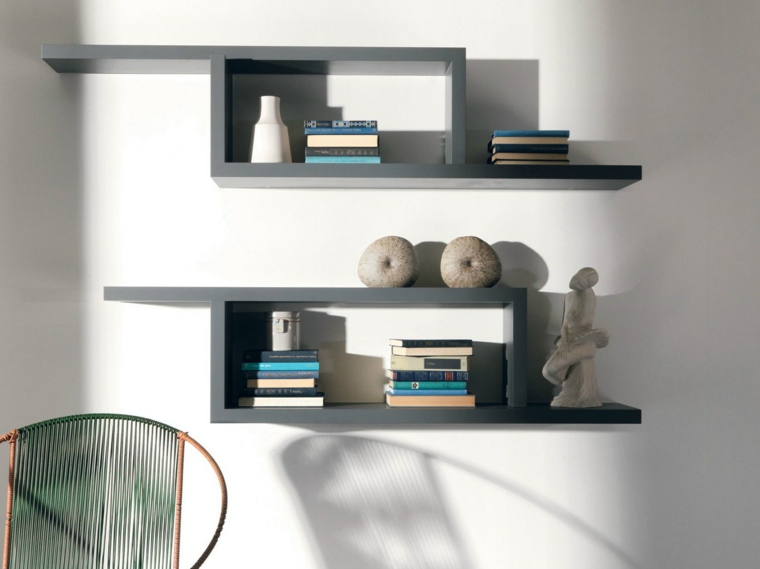
This screenshot has width=760, height=569. I want to click on art, so click(x=552, y=387), click(x=470, y=267), click(x=393, y=263), click(x=280, y=333), click(x=271, y=152).